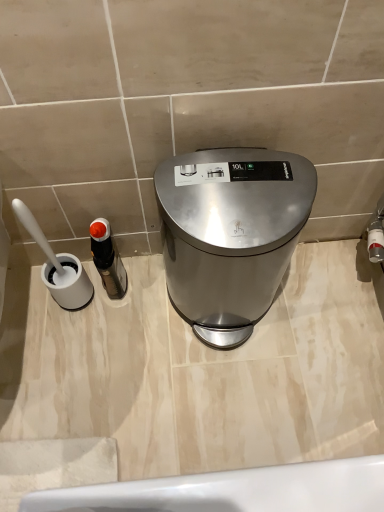
Question: Is satin silver trash can at center positioned far away from black plastic bottle at left?

Choices:
 (A) no
 (B) yes

Answer: (A)

Question: Does satin silver trash can at center have a larger size compared to black plastic bottle at left?

Choices:
 (A) no
 (B) yes

Answer: (B)

Question: From the image's perspective, is satin silver trash can at center below black plastic bottle at left?

Choices:
 (A) yes
 (B) no

Answer: (B)

Question: From a real-world perspective, is satin silver trash can at center positioned under black plastic bottle at left based on gravity?

Choices:
 (A) no
 (B) yes

Answer: (A)

Question: Does satin silver trash can at center come behind black plastic bottle at left?

Choices:
 (A) yes
 (B) no

Answer: (B)

Question: Does satin silver trash can at center have a lesser width compared to black plastic bottle at left?

Choices:
 (A) no
 (B) yes

Answer: (A)

Question: Can you confirm if black plastic bottle at left is taller than satin silver trash can at center?

Choices:
 (A) no
 (B) yes

Answer: (A)

Question: From the image's perspective, is black plastic bottle at left beneath satin silver trash can at center?

Choices:
 (A) yes
 (B) no

Answer: (A)

Question: From a real-world perspective, is black plastic bottle at left below satin silver trash can at center?

Choices:
 (A) no
 (B) yes

Answer: (B)

Question: Is the position of black plastic bottle at left less distant than that of satin silver trash can at center?

Choices:
 (A) yes
 (B) no

Answer: (B)

Question: Would you say satin silver trash can at center is part of black plastic bottle at left's contents?

Choices:
 (A) no
 (B) yes

Answer: (A)

Question: From a real-world perspective, is black plastic bottle at left located higher than satin silver trash can at center?

Choices:
 (A) yes
 (B) no

Answer: (B)

Question: Considering the positions of black plastic bottle at left and satin silver trash can at center in the image, is black plastic bottle at left taller or shorter than satin silver trash can at center?

Choices:
 (A) short
 (B) tall

Answer: (A)